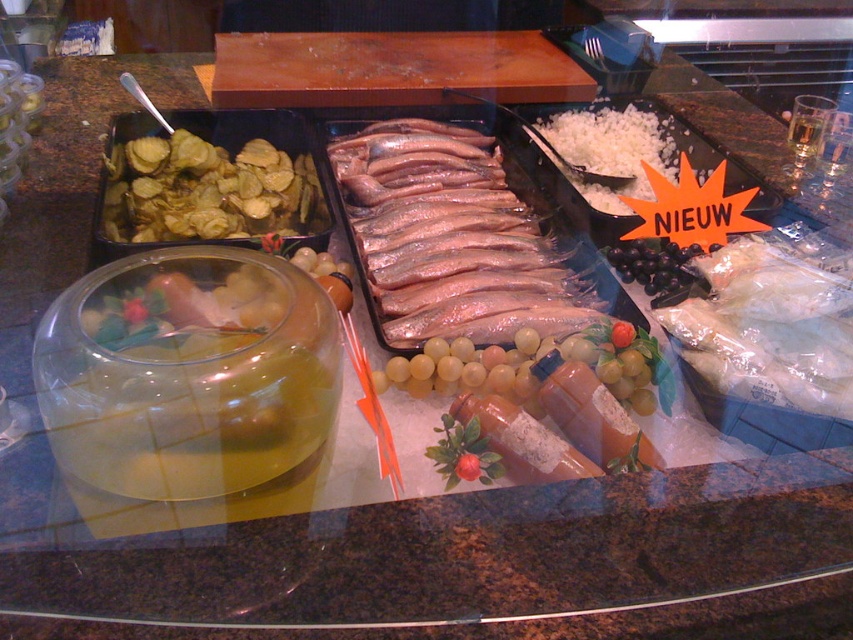
You are standing in front of the buffet display. There are two points marked on the glass countertop. The first point is at coordinates point (477,288) and the second is at point (132,177). Which point is closer to you as you face the buffet?

Point (477,288) is in front of point (132,177), so it is closer to you as you face the buffet.